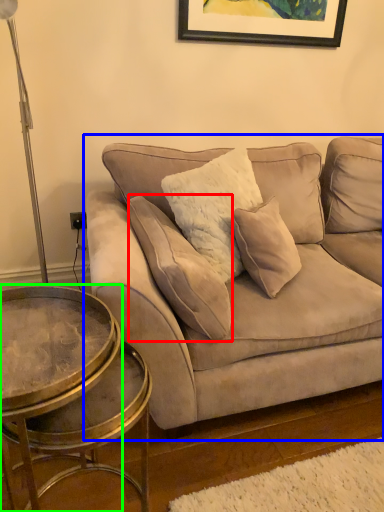
Question: Based on their relative distances, which object is farther from pillow (highlighted by a red box)? Choose from studio couch (highlighted by a blue box) and coffee table (highlighted by a green box).

Choices:
 (A) studio couch
 (B) coffee table

Answer: (B)